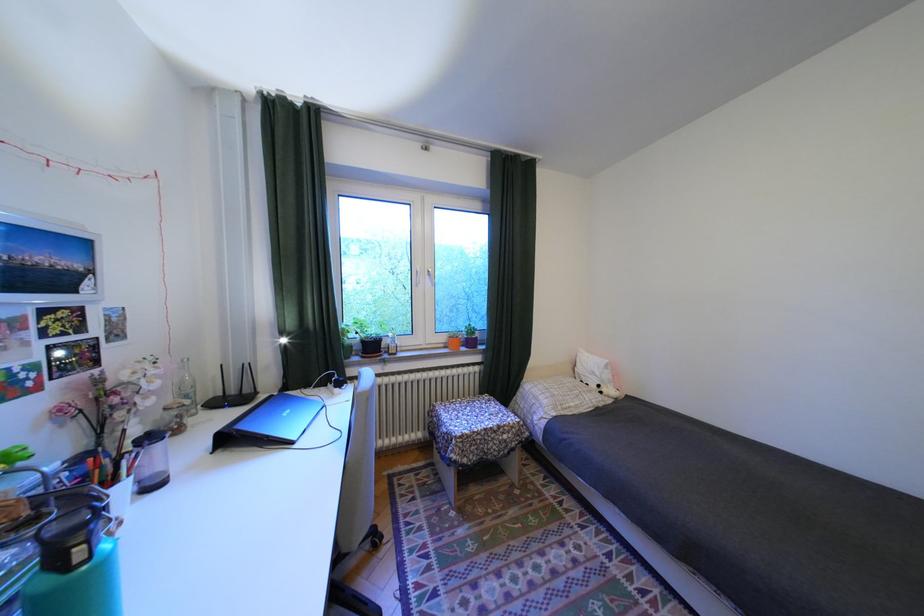
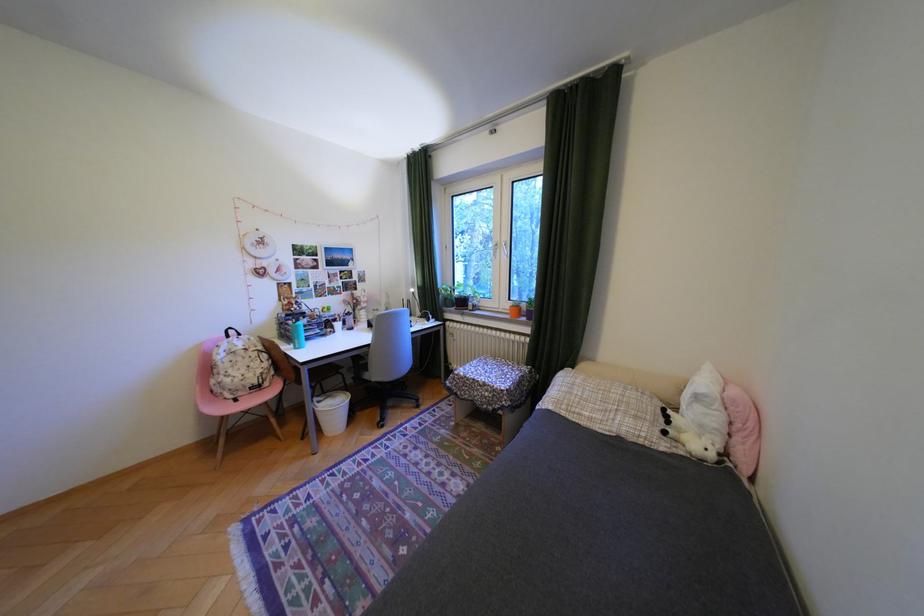
Locate, in the second image, the point that corresponds to pixel 613 392 in the first image.

(676, 432)